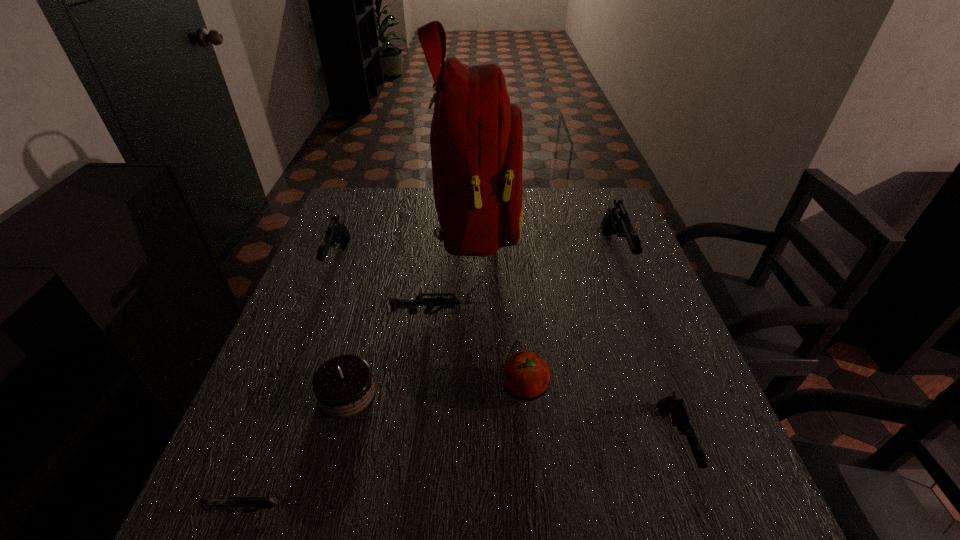
Where is `blank area in the image that satisfies the following two spatial constraints: 1. at the end of the barrel of the second tallest object; 2. aimed along the barrel of the third gun from right to left`? The height and width of the screenshot is (540, 960). blank area in the image that satisfies the following two spatial constraints: 1. at the end of the barrel of the second tallest object; 2. aimed along the barrel of the third gun from right to left is located at coordinates (636, 314).

The width and height of the screenshot is (960, 540). Find the location of `vacant region that satisfies the following two spatial constraints: 1. at the end of the barrel of the smallest black gun; 2. aimed along the barrel of the shortest gun`. vacant region that satisfies the following two spatial constraints: 1. at the end of the barrel of the smallest black gun; 2. aimed along the barrel of the shortest gun is located at coordinates (699, 511).

Identify the location of free point that satisfies the following two spatial constraints: 1. on the front-facing side of the apple; 2. on the right side of the pink backpack. (475, 389).

Where is `vacant space that satisfies the following two spatial constraints: 1. at the end of the barrel of the tallest gun; 2. aimed along the barrel of the second shortest object`? This screenshot has width=960, height=540. vacant space that satisfies the following two spatial constraints: 1. at the end of the barrel of the tallest gun; 2. aimed along the barrel of the second shortest object is located at coordinates (636, 314).

You are a GUI agent. You are given a task and a screenshot of the screen. Output one action in this format:
    pyautogui.click(x=<x>, y=<y>)
    Task: Click on the free space that satisfies the following two spatial constraints: 1. on the front-facing side of the pink backpack; 2. at the end of the barrel of the second tallest gun
    The height and width of the screenshot is (540, 960).
    Given the screenshot: What is the action you would take?
    pyautogui.click(x=476, y=260)